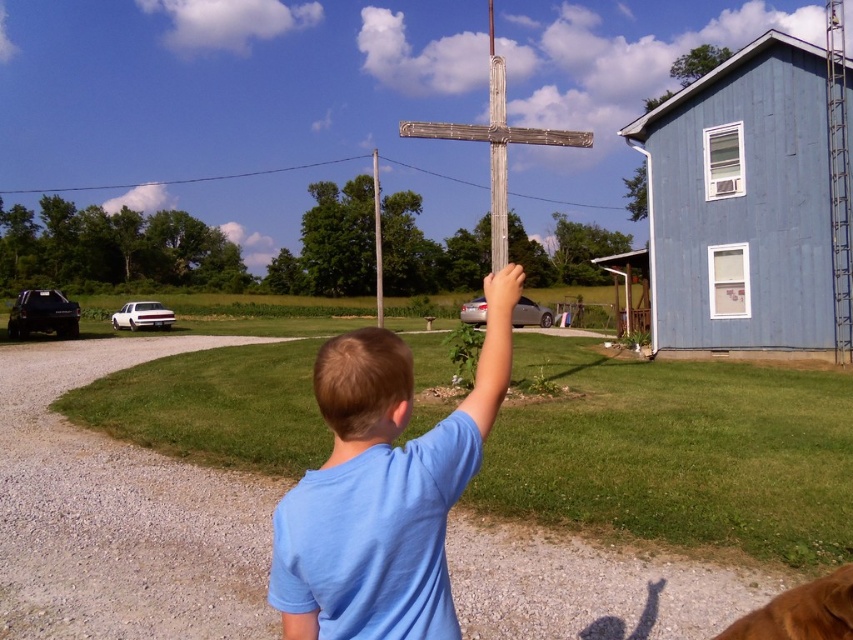
Which is more to the left, blue cotton shirt at center or brown wooden telegraph pole at center?

brown wooden telegraph pole at center

Does blue cotton shirt at center appear on the left side of brown wooden telegraph pole at center?

In fact, blue cotton shirt at center is to the right of brown wooden telegraph pole at center.

Describe the element at coordinates (386, 472) in the screenshot. This screenshot has height=640, width=853. I see `blue cotton shirt at center` at that location.

You are a GUI agent. You are given a task and a screenshot of the screen. Output one action in this format:
    pyautogui.click(x=<x>, y=<y>)
    Task: Click on the blue cotton shirt at center
    This screenshot has height=640, width=853.
    Given the screenshot: What is the action you would take?
    pyautogui.click(x=386, y=472)

Does wooden cross at upper center have a greater width compared to brown wooden telegraph pole at center?

Indeed, wooden cross at upper center has a greater width compared to brown wooden telegraph pole at center.

Is the position of wooden cross at upper center less distant than that of brown wooden telegraph pole at center?

Yes.

Between point (468, 131) and point (375, 257), which one is positioned in front?

Positioned in front is point (468, 131).

Identify the location of wooden cross at upper center. This screenshot has width=853, height=640. pos(496,148).

Can you confirm if brown furry dog at lower right is taller than brown wooden telegraph pole at center?

No, brown furry dog at lower right is not taller than brown wooden telegraph pole at center.

Who is higher up, brown furry dog at lower right or brown wooden telegraph pole at center?

Positioned higher is brown wooden telegraph pole at center.

Who is more forward, (x=809, y=596) or (x=376, y=237)?

Point (x=809, y=596)

In order to click on brown furry dog at lower right in this screenshot , I will do `click(801, 611)`.